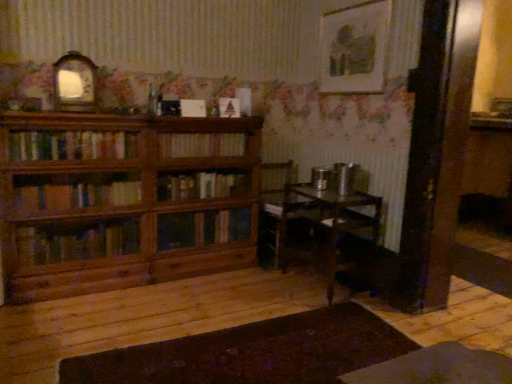
Question: In terms of size, does wooden bookcase at left appear bigger or smaller than matte white triangle at center, arranged as the first book when viewed from the top?

Choices:
 (A) small
 (B) big

Answer: (B)

Question: In terms of width, does wooden bookcase at left look wider or thinner when compared to matte white triangle at center, the 2th book from the bottom?

Choices:
 (A) wide
 (B) thin

Answer: (A)

Question: Considering the real-world distances, which object is closest to the wooden chair at center?

Choices:
 (A) wooden bookshelf at center, acting as the first book starting from the bottom
 (B) wooden bookcase at left
 (C) wooden table at center
 (D) matte white triangle at center, the 2th book from the bottom
 (E) matte white picture frame at upper right, marked as the 2th picture frame in a left-to-right arrangement

Answer: (C)

Question: Estimate the real-world distances between objects in this image. Which object is closer to the wooden bookshelf at center, which is counted as the 2th book, starting from the top?

Choices:
 (A) matte white triangle at center, arranged as the first book when viewed from the top
 (B) wooden chair at center
 (C) matte white picture frame at upper right, which ranks as the first picture frame in right-to-left order
 (D) wooden table at center
 (E) wooden bookcase at left

Answer: (A)